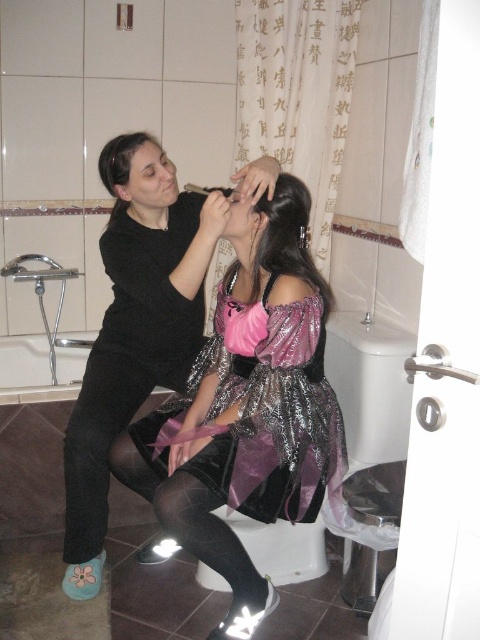
Question: Which object is positioned closest to the matte black dress at center?

Choices:
 (A) black matte pants at lower left
 (B) dark brown silky hair at upper center
 (C) shiny purple dress at center

Answer: (A)

Question: Is shiny purple dress at center behind dark brown silky hair at upper center?

Choices:
 (A) no
 (B) yes

Answer: (A)

Question: Which of these objects is positioned closest to the shiny dark hair at center?

Choices:
 (A) matte black dress at center
 (B) dark brown silky hair at upper center
 (C) shiny purple dress at center

Answer: (C)

Question: Is black matte pants at lower left closer to camera compared to shiny dark hair at center?

Choices:
 (A) yes
 (B) no

Answer: (B)

Question: Estimate the real-world distances between objects in this image. Which object is farther from the shiny dark hair at center?

Choices:
 (A) dark brown silky hair at upper center
 (B) shiny purple dress at center

Answer: (A)

Question: In this image, where is shiny purple dress at center located relative to black matte pants at lower left?

Choices:
 (A) left
 (B) right

Answer: (B)